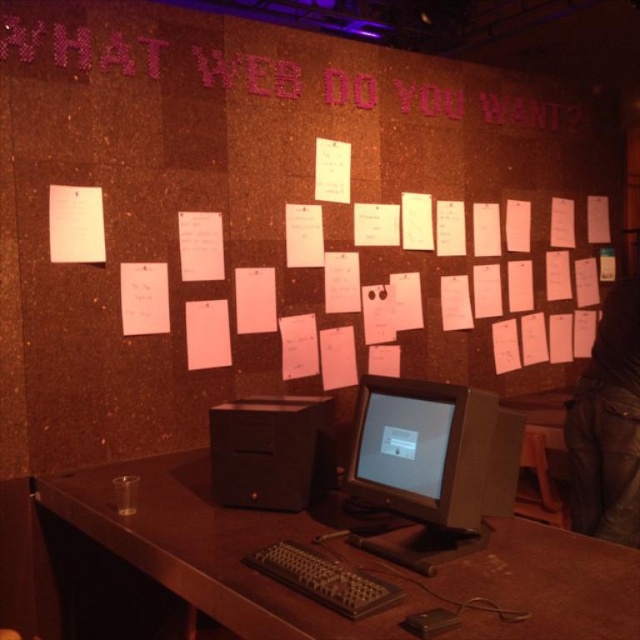
Does black plastic computer at center have a larger size compared to black plastic keyboard at lower center?

Correct, black plastic computer at center is larger in size than black plastic keyboard at lower center.

Which is more to the left, black plastic computer at center or black plastic keyboard at lower center?

From the viewer's perspective, black plastic computer at center appears more on the left side.

Image resolution: width=640 pixels, height=640 pixels. What do you see at coordinates (272, 451) in the screenshot?
I see `black plastic computer at center` at bounding box center [272, 451].

I want to click on black plastic computer at center, so click(272, 451).

Can you confirm if brown wooden table at center is positioned to the left of matte black monitor at center?

Indeed, brown wooden table at center is positioned on the left side of matte black monitor at center.

Who is higher up, brown wooden table at center or matte black monitor at center?

matte black monitor at center is higher up.

What do you see at coordinates (346, 561) in the screenshot?
I see `brown wooden table at center` at bounding box center [346, 561].

I want to click on brown wooden table at center, so click(x=346, y=561).

Can you confirm if pink pixelated text at upper center is shorter than black plastic computer at center?

No, pink pixelated text at upper center is not shorter than black plastic computer at center.

Consider the image. Which is below, pink pixelated text at upper center or black plastic computer at center?

black plastic computer at center is lower down.

This screenshot has height=640, width=640. Identify the location of pink pixelated text at upper center. (81, 48).